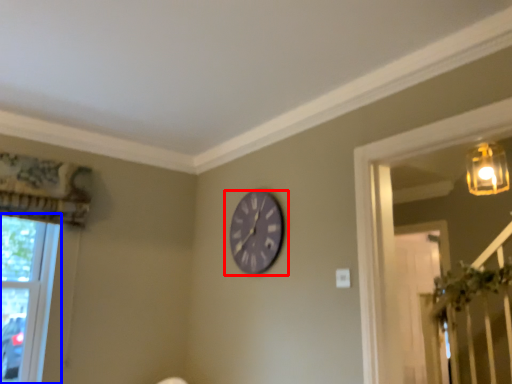
Question: Which object is further to the camera taking this photo, wall clock (highlighted by a red box) or window (highlighted by a blue box)?

Choices:
 (A) wall clock
 (B) window

Answer: (A)